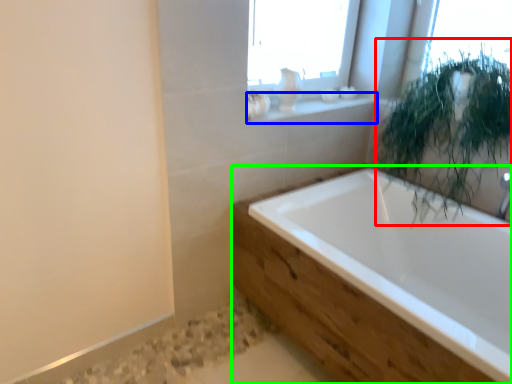
Question: Which object is the closest to the vegetation (highlighted by a red box)? Choose among these: window sill (highlighted by a blue box) or bathtub (highlighted by a green box).

Choices:
 (A) window sill
 (B) bathtub

Answer: (B)